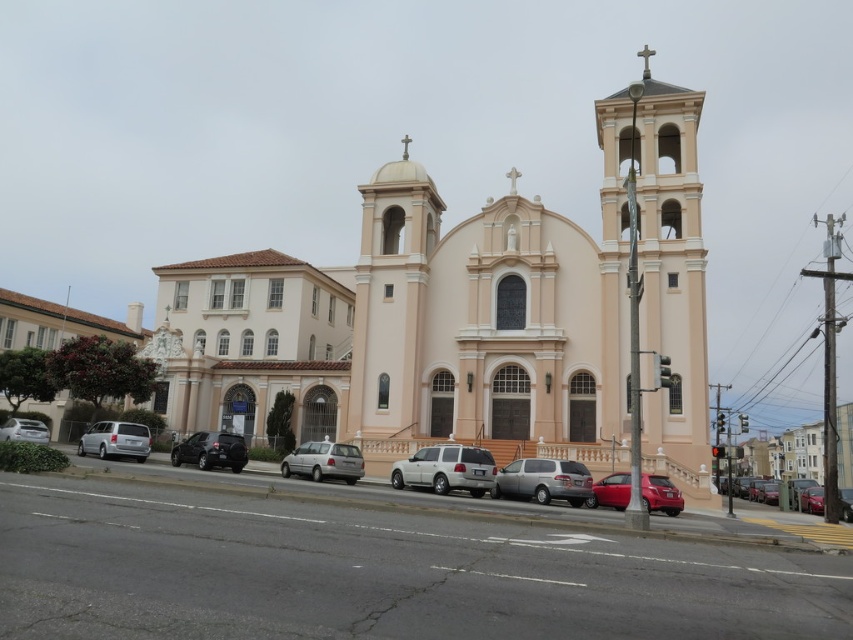
You are a photographer standing at the entrance of the pink stucco church at center. You want to take a photo of the metallic red car at lower right without the church blocking the view. Is it possible?

The pink stucco church at center is in front of the metallic red car at lower right, so the church will block the view of the car. Therefore, it is not possible to take a photo of the metallic red car at lower right without the church blocking the view.

Looking at this image, you are standing in front of the church and want to determine the relative positions of two points marked on the facade. Which point is closer to you, point [297,388] or point [677,496]?

Point [297,388] is closer to you because it is further to the viewer than point [677,496].

You are a photographer planning to take a picture of the pink stucco church at center and the metallic red car at lower right. Which object should you focus on first if you want to capture both in the frame without moving the camera?

You should focus on the pink stucco church at center first because it is larger and more prominent in the scene, ensuring it remains the main subject while the metallic red car at lower right can be included in the background or corner of the frame.